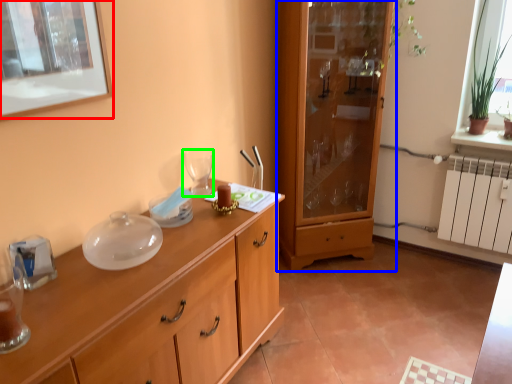
Question: Estimate the real-world distances between objects in this image. Which object is closer to picture frame (highlighted by a red box), cabinetry (highlighted by a blue box) or wine glass (highlighted by a green box)?

Choices:
 (A) cabinetry
 (B) wine glass

Answer: (B)